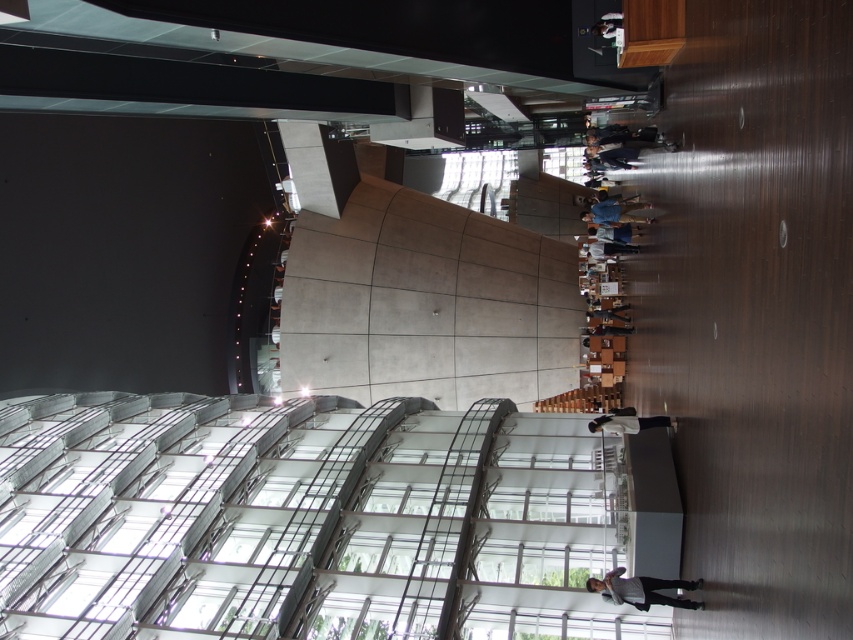
Question: Which of these objects is positioned farthest from the white shirt at center?

Choices:
 (A) light brown leather jacket at center
 (B) dark gray concrete person at center
 (C) white matte jacket at center

Answer: (B)

Question: Is light brown leather jacket at center wider than dark gray concrete person at center?

Choices:
 (A) yes
 (B) no

Answer: (B)

Question: Which object is closer to the camera taking this photo?

Choices:
 (A) light brown leather jacket at center
 (B) dark gray concrete person at center
 (C) denim jacket at center

Answer: (C)

Question: Where is white shirt at center located in relation to white matte jacket at center in the image?

Choices:
 (A) left
 (B) right

Answer: (A)

Question: Does white matte jacket at center lie in front of dark gray concrete person at center?

Choices:
 (A) no
 (B) yes

Answer: (B)

Question: Which point is closer to the camera?

Choices:
 (A) (601, 212)
 (B) (610, 330)

Answer: (A)